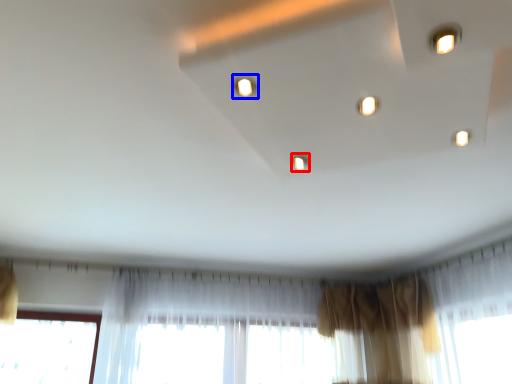
Question: Which point is further to the camera, light (highlighted by a red box) or light (highlighted by a blue box)?

Choices:
 (A) light
 (B) light

Answer: (A)